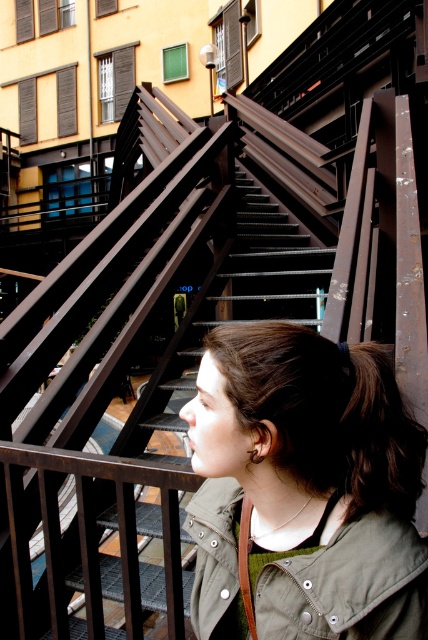
Which of these two, matte olive green jacket at lower right or brown matte hair at lower right, stands shorter?

brown matte hair at lower right is shorter.

Can you confirm if matte olive green jacket at lower right is wider than brown matte hair at lower right?

Yes, matte olive green jacket at lower right is wider than brown matte hair at lower right.

Does point (368, 448) come behind point (356, 474)?

Yes, point (368, 448) is behind point (356, 474).

Where is `matte olive green jacket at lower right`? This screenshot has height=640, width=428. matte olive green jacket at lower right is located at coordinates (303, 490).